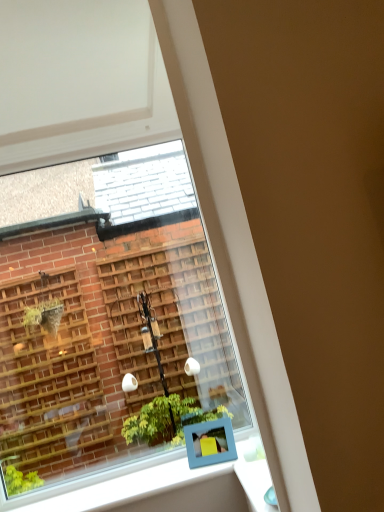
Question: Looking at their shapes, would you say clear glass window at upper left is wider or thinner than blue plastic frame at lower center?

Choices:
 (A) wide
 (B) thin

Answer: (B)

Question: Is clear glass window at upper left taller or shorter than blue plastic frame at lower center?

Choices:
 (A) tall
 (B) short

Answer: (A)

Question: Estimate the real-world distances between objects in this image. Which object is closer to the white glossy window sill at lower center?

Choices:
 (A) clear glass window at upper left
 (B) blue plastic frame at lower center

Answer: (B)

Question: Considering the real-world distances, which object is farthest from the blue plastic frame at lower center?

Choices:
 (A) white glossy window sill at lower center
 (B) clear glass window at upper left

Answer: (B)